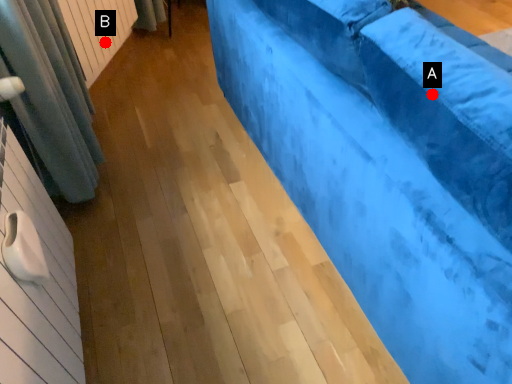
Question: Two points are circled on the image, labeled by A and B beside each circle. Which of the following is the closest to the observer?

Choices:
 (A) A is closer
 (B) B is closer

Answer: (A)